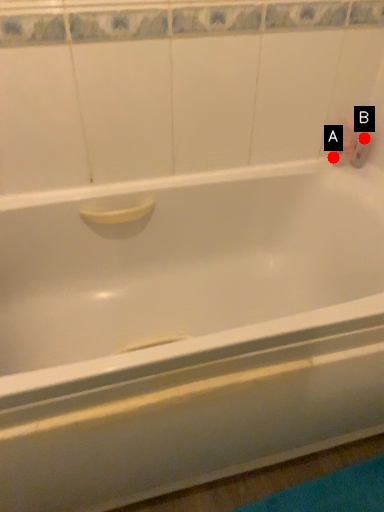
Question: Two points are circled on the image, labeled by A and B beside each circle. Among these points, which one is farthest from the camera?

Choices:
 (A) A is further
 (B) B is further

Answer: (A)